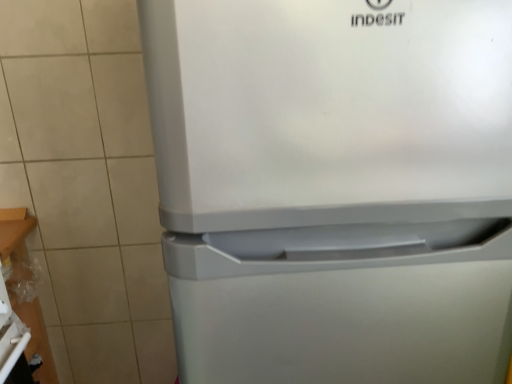
Locate an element on the screen. The height and width of the screenshot is (384, 512). satin silver refrigerator at center is located at coordinates (334, 187).

This screenshot has width=512, height=384. What do you see at coordinates (334, 187) in the screenshot?
I see `satin silver refrigerator at center` at bounding box center [334, 187].

What is the approximate height of satin silver refrigerator at center?

3.81 feet.

You are a GUI agent. You are given a task and a screenshot of the screen. Output one action in this format:
    pyautogui.click(x=<x>, y=<y>)
    Task: Click on the satin silver refrigerator at center
    
    Given the screenshot: What is the action you would take?
    pyautogui.click(x=334, y=187)